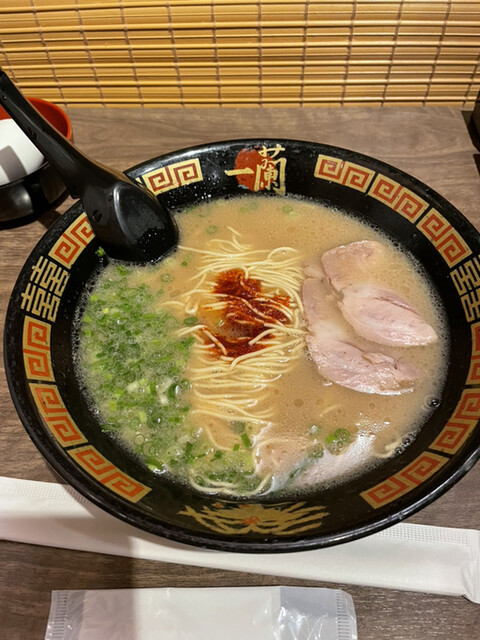
The width and height of the screenshot is (480, 640). In order to click on top right inside of black bowl in this screenshot , I will do `click(54, 116)`.